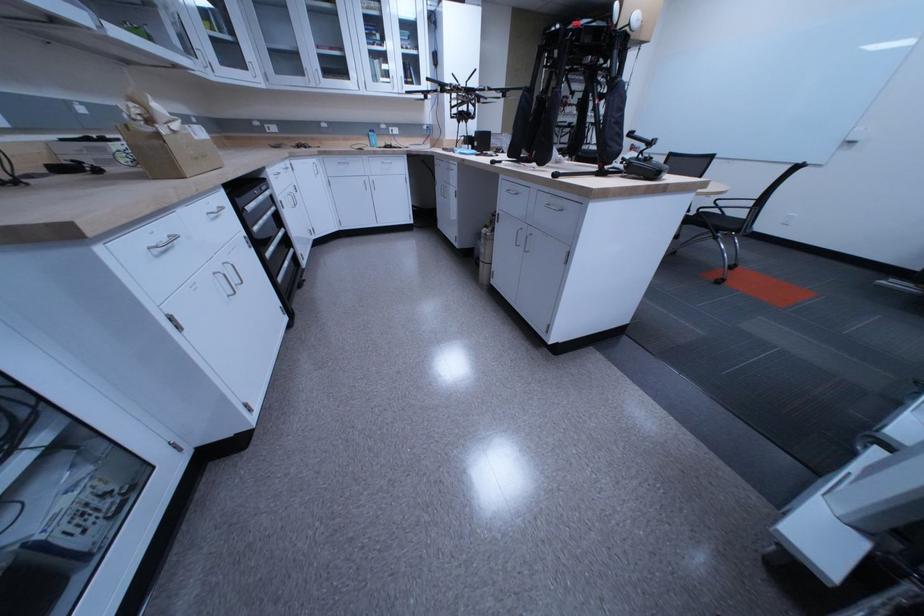
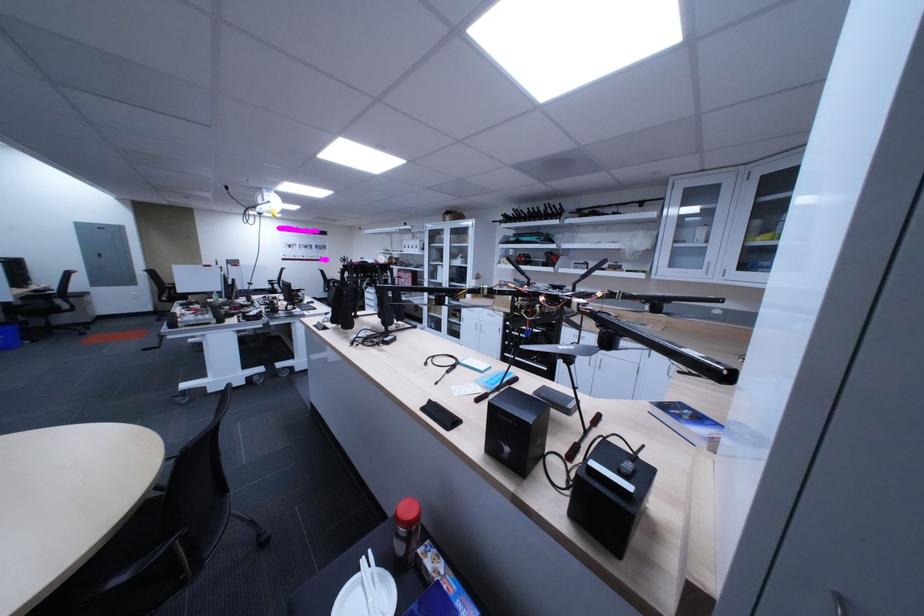
Locate, in the second image, the point that corresponds to point (195, 330) in the first image.

(478, 323)